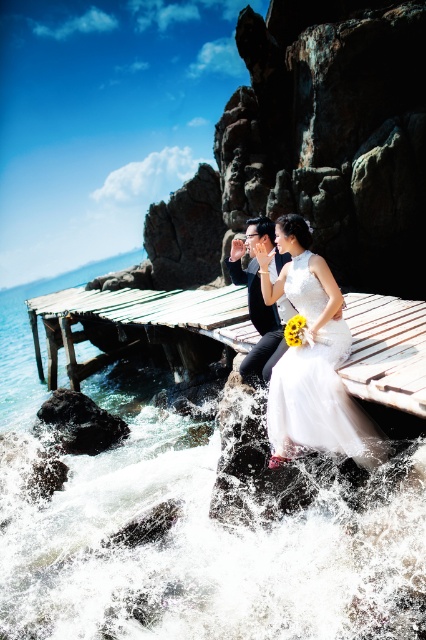
Looking at this image, you are a photographer planning to capture the couple on the pier. Given the white frothy water at lower center and the matte black suit at center, which object in the scene would you consider more prominent in terms of visual size?

The white frothy water at lower center is larger in size than the matte black suit at center, making it more prominent in visual size.

You are a photographer positioned at the end of the wooden pier. You need to capture a photo where the white satin dress at center is centered in the frame while ensuring the clear blue water at dock left remains visible. Based on their positions, is this possible?

The white satin dress at center is to the right of clear blue water at dock left, so positioning the dress centrally would require angling the camera to include both elements. This is feasible as their relative positions allow for framing both in the shot.

You are a photographer planning to capture the couple on the weathered wood dock at center and the white satin dress at center. Given the size difference between the two, how would you adjust your camera angle to ensure both are clearly visible in the frame?

Since the weathered wood dock at center is larger than the white satin dress at center, you should position the camera closer to the white satin dress at center to balance their sizes in the frame.